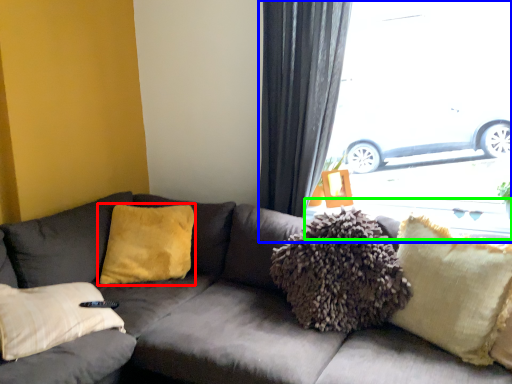
Question: Which object is positioned closest to pillow (highlighted by a red box)? Select from window (highlighted by a blue box) and window sill (highlighted by a green box).

Choices:
 (A) window
 (B) window sill

Answer: (B)